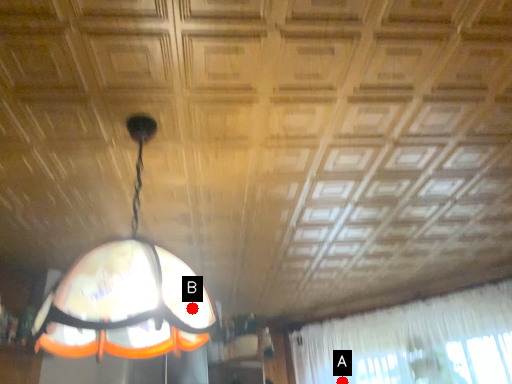
Question: Two points are circled on the image, labeled by A and B beside each circle. Among these points, which one is nearest to the camera?

Choices:
 (A) A is closer
 (B) B is closer

Answer: (B)